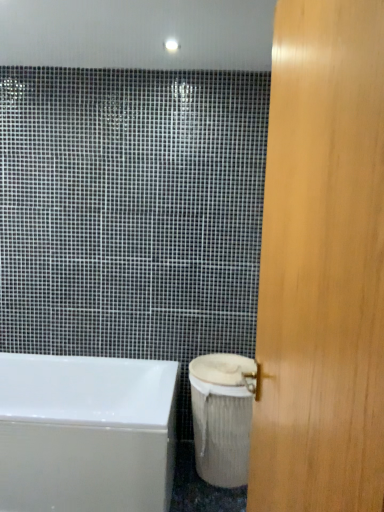
Question: Is wooden door at right positioned far away from white textured toilet bowl at lower right?

Choices:
 (A) no
 (B) yes

Answer: (B)

Question: From a real-world perspective, is wooden door at right on white textured toilet bowl at lower right?

Choices:
 (A) no
 (B) yes

Answer: (B)

Question: Is wooden door at right taller than white textured toilet bowl at lower right?

Choices:
 (A) yes
 (B) no

Answer: (A)

Question: Could you tell me if wooden door at right is facing white textured toilet bowl at lower right?

Choices:
 (A) yes
 (B) no

Answer: (B)

Question: Is wooden door at right to the left of white textured toilet bowl at lower right from the viewer's perspective?

Choices:
 (A) no
 (B) yes

Answer: (A)

Question: From the image's perspective, is white textured toilet bowl at lower right located above or below wooden door at right?

Choices:
 (A) above
 (B) below

Answer: (B)

Question: Do you think white textured toilet bowl at lower right is within wooden door at right, or outside of it?

Choices:
 (A) outside
 (B) inside

Answer: (A)

Question: Considering the positions of white textured toilet bowl at lower right and wooden door at right in the image, is white textured toilet bowl at lower right taller or shorter than wooden door at right?

Choices:
 (A) tall
 (B) short

Answer: (B)

Question: Visually, is white textured toilet bowl at lower right positioned to the left or to the right of wooden door at right?

Choices:
 (A) left
 (B) right

Answer: (A)

Question: Based on their sizes in the image, would you say white textured toilet bowl at lower right is bigger or smaller than white glossy bathtub at lower left?

Choices:
 (A) big
 (B) small

Answer: (B)

Question: Considering their positions, is white textured toilet bowl at lower right located in front of or behind white glossy bathtub at lower left?

Choices:
 (A) behind
 (B) front

Answer: (A)

Question: Based on their positions, is white textured toilet bowl at lower right located to the left or right of white glossy bathtub at lower left?

Choices:
 (A) left
 (B) right

Answer: (B)

Question: In terms of width, does white textured toilet bowl at lower right look wider or thinner when compared to white glossy bathtub at lower left?

Choices:
 (A) wide
 (B) thin

Answer: (B)

Question: Is white glossy bathtub at lower left in front of or behind wooden door at right in the image?

Choices:
 (A) behind
 (B) front

Answer: (A)

Question: Looking at their shapes, would you say white glossy bathtub at lower left is wider or thinner than wooden door at right?

Choices:
 (A) wide
 (B) thin

Answer: (A)